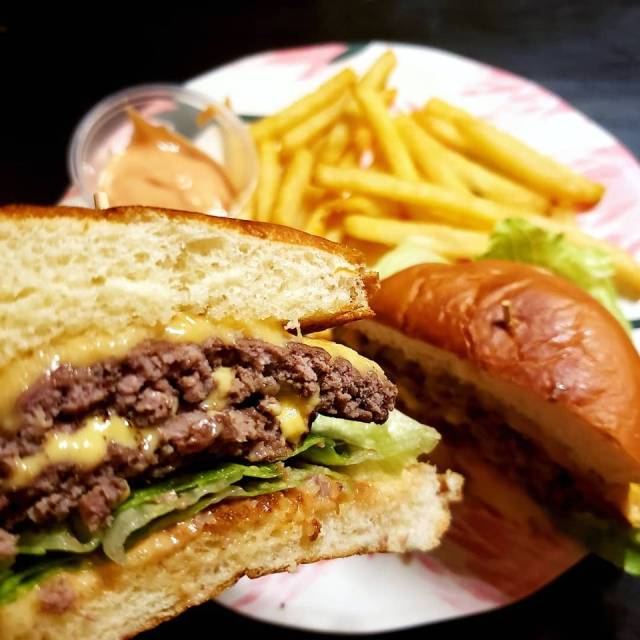
The height and width of the screenshot is (640, 640). Identify the location of cup. (187, 116).